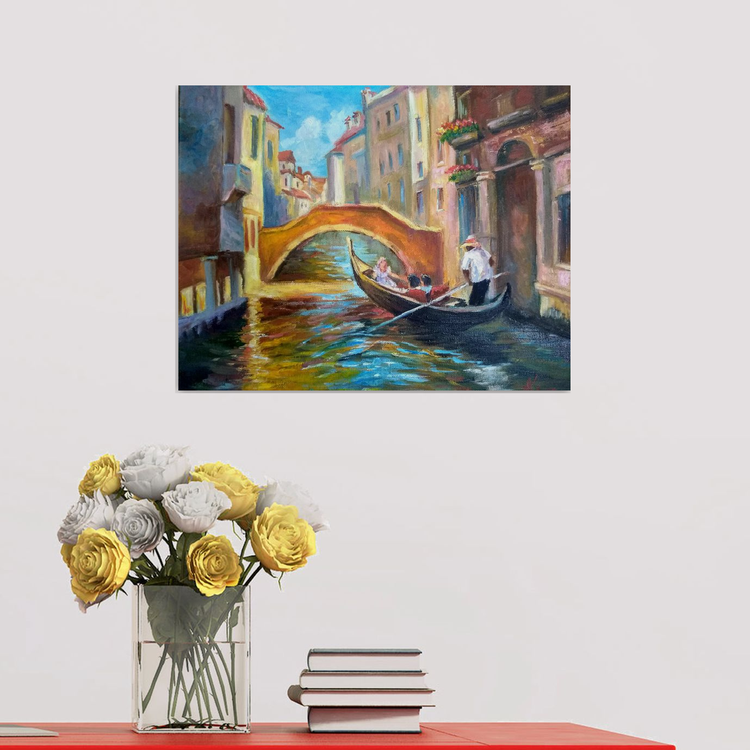
Locate an element on the screen. This screenshot has height=750, width=750. books is located at coordinates (363, 661), (363, 678), (368, 694), (370, 724).